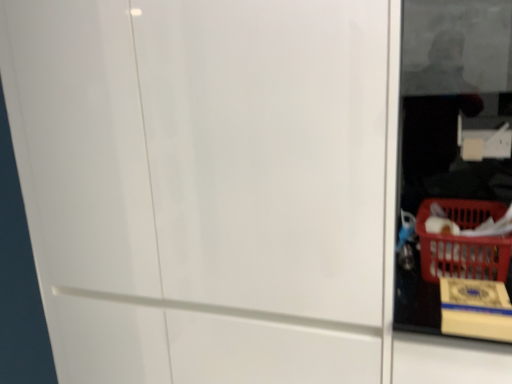
Question: From the image's perspective, is white glossy screen door at center on top of yellow cardboard box at lower right?

Choices:
 (A) yes
 (B) no

Answer: (A)

Question: From the image's perspective, does white glossy screen door at center appear lower than yellow cardboard box at lower right?

Choices:
 (A) yes
 (B) no

Answer: (B)

Question: Is white glossy screen door at center to the right of yellow cardboard box at lower right from the viewer's perspective?

Choices:
 (A) no
 (B) yes

Answer: (A)

Question: Can you confirm if white glossy screen door at center is thinner than yellow cardboard box at lower right?

Choices:
 (A) yes
 (B) no

Answer: (B)

Question: Can yellow cardboard box at lower right be found inside white glossy screen door at center?

Choices:
 (A) no
 (B) yes

Answer: (A)

Question: Does white glossy screen door at center appear on the left side of yellow cardboard box at lower right?

Choices:
 (A) yes
 (B) no

Answer: (A)

Question: Is yellow cardboard box at lower right beside white glossy screen door at center?

Choices:
 (A) yes
 (B) no

Answer: (B)

Question: Could white glossy screen door at center be considered to be inside yellow cardboard box at lower right?

Choices:
 (A) no
 (B) yes

Answer: (A)

Question: From a real-world perspective, is yellow cardboard box at lower right on white glossy screen door at center?

Choices:
 (A) yes
 (B) no

Answer: (B)

Question: Considering the relative sizes of yellow cardboard box at lower right and white glossy screen door at center in the image provided, is yellow cardboard box at lower right thinner than white glossy screen door at center?

Choices:
 (A) yes
 (B) no

Answer: (A)

Question: From the image's perspective, is yellow cardboard box at lower right on top of white glossy screen door at center?

Choices:
 (A) no
 (B) yes

Answer: (A)

Question: Is yellow cardboard box at lower right to the right of white glossy screen door at center from the viewer's perspective?

Choices:
 (A) yes
 (B) no

Answer: (A)

Question: Is yellow cardboard box at lower right positioned beyond the bounds of red plastic basket at lower right?

Choices:
 (A) yes
 (B) no

Answer: (A)